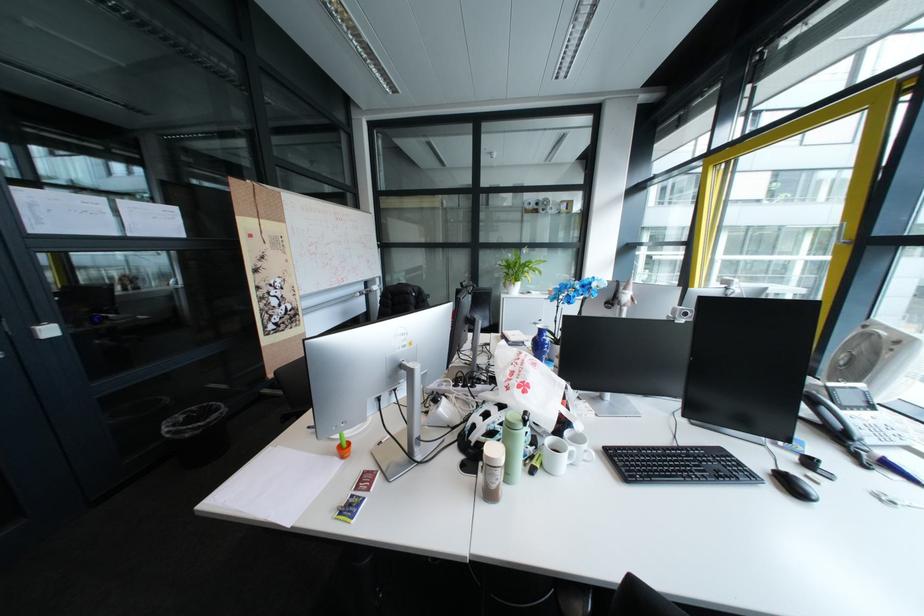
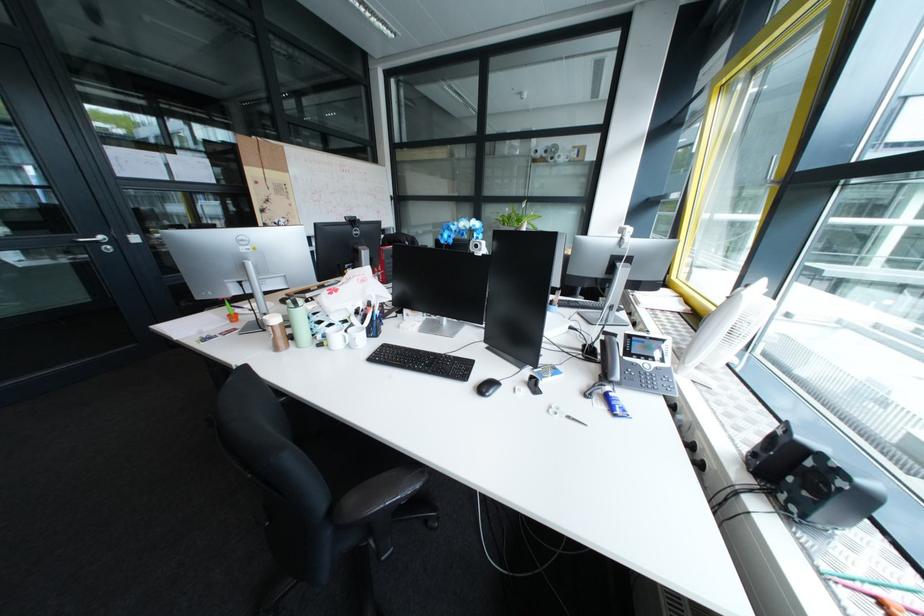
Question: The images are taken continuously from a first-person perspective. In which direction are you moving?

Choices:
 (A) Left
 (B) Right
 (C) Forward
 (D) Backward

Answer: (B)